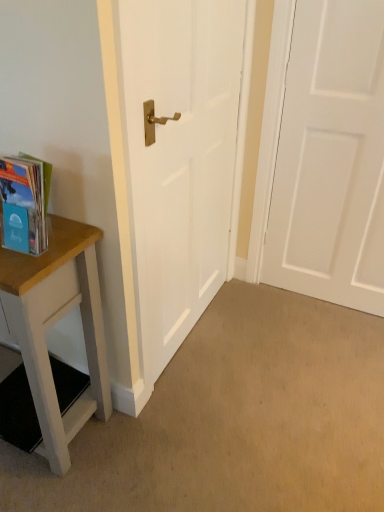
In order to click on free space in front of white matte door at right, which is the 1th door from right to left in this screenshot , I will do `click(324, 348)`.